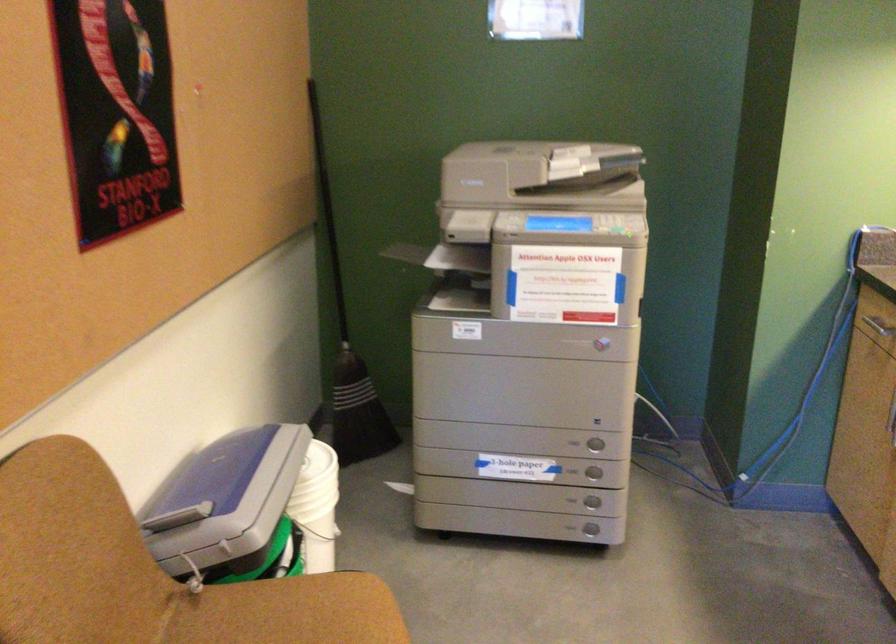
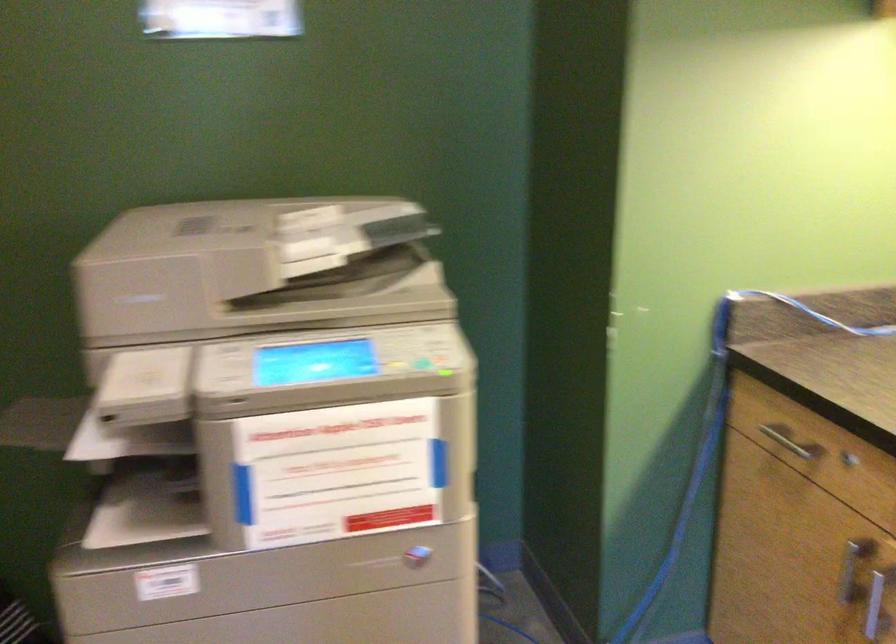
Question: What movement of the cameraman would produce the second image?

Choices:
 (A) Left
 (B) Right
 (C) Forward
 (D) Backward

Answer: (C)